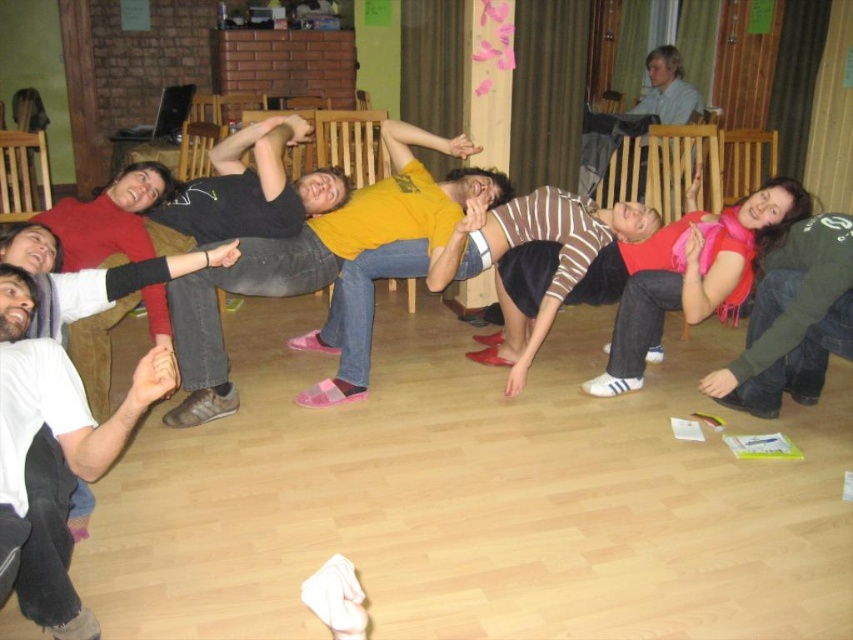
Who is more distant from viewer, (13, 400) or (688, 228)?

Point (688, 228)

What do you see at coordinates (54, 442) in the screenshot? The height and width of the screenshot is (640, 853). I see `white cotton shirt at lower left` at bounding box center [54, 442].

The height and width of the screenshot is (640, 853). Identify the location of white cotton shirt at lower left. (54, 442).

Can you confirm if pink scarf at center is thinner than green fuzzy sweater at right?

In fact, pink scarf at center might be wider than green fuzzy sweater at right.

Does point (654, 284) lie in front of point (840, 230)?

No.

Describe the element at coordinates (692, 275) in the screenshot. I see `pink scarf at center` at that location.

Where is `pink scarf at center`? pink scarf at center is located at coordinates (692, 275).

Looking at this image, does white cotton shirt at lower left have a smaller size compared to green fuzzy sweater at right?

Yes.

Is white cotton shirt at lower left in front of green fuzzy sweater at right?

That is True.

Is point (57, 435) in front of point (753, 412)?

Yes, it is.

Image resolution: width=853 pixels, height=640 pixels. Identify the location of white cotton shirt at lower left. (54, 442).